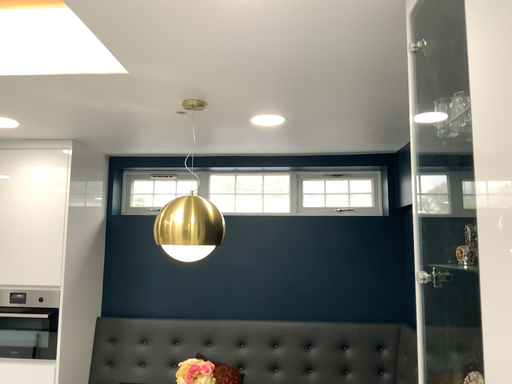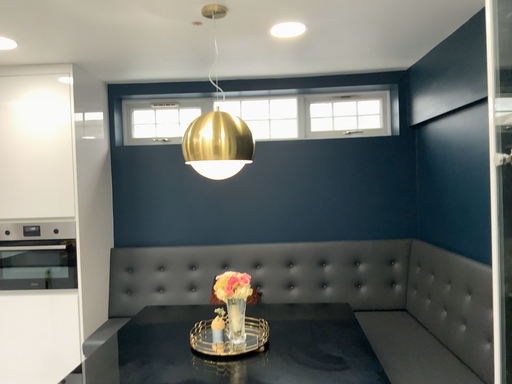
Question: How did the camera likely rotate when shooting the video?

Choices:
 (A) rotated upward
 (B) rotated downward

Answer: (B)